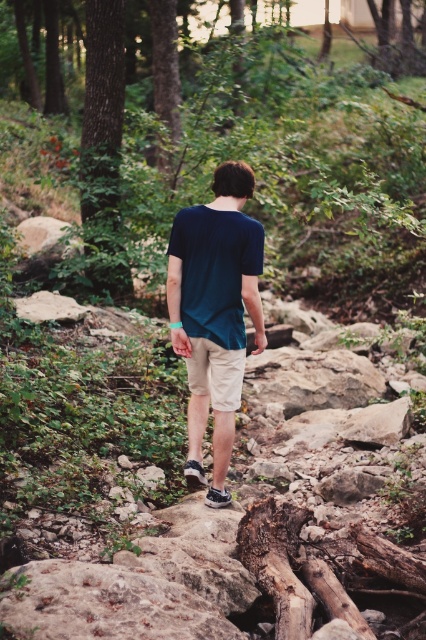
Question: Which object appears closest to the camera in this image?

Choices:
 (A) dark blue cotton shirt at center
 (B) khaki cotton shorts at center

Answer: (A)

Question: Is dark blue cotton shirt at center further to the viewer compared to khaki cotton shorts at center?

Choices:
 (A) yes
 (B) no

Answer: (B)

Question: Is dark blue cotton shirt at center positioned in front of khaki cotton shorts at center?

Choices:
 (A) yes
 (B) no

Answer: (A)

Question: Does dark blue cotton shirt at center lie behind khaki cotton shorts at center?

Choices:
 (A) yes
 (B) no

Answer: (B)